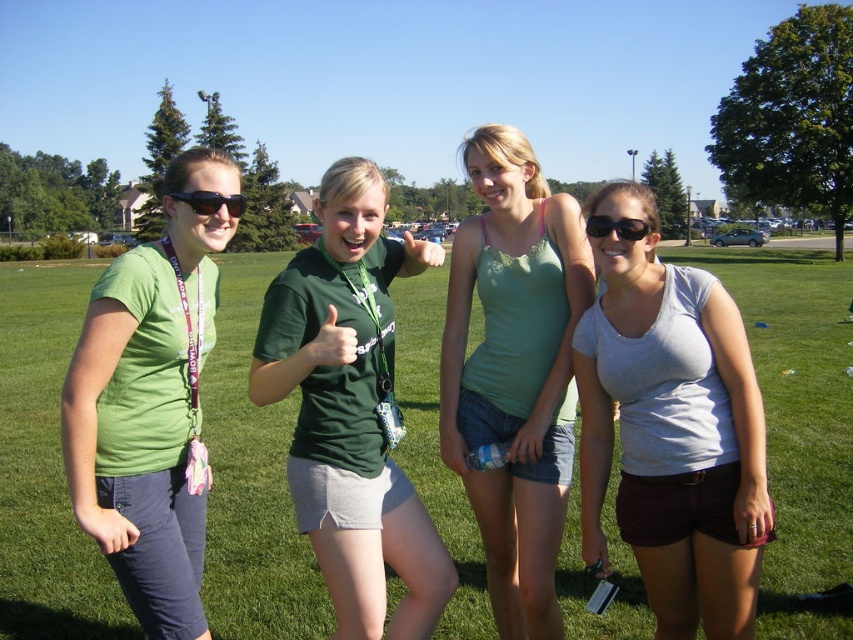
Question: Does green lace tank top at center have a greater width compared to green fabric shirt at left?

Choices:
 (A) yes
 (B) no

Answer: (A)

Question: Considering the relative positions of green grass at center and green fabric shirt at center in the image provided, where is green grass at center located with respect to green fabric shirt at center?

Choices:
 (A) below
 (B) above

Answer: (B)

Question: Can you confirm if green lace tank top at center is wider than black plastic sunglasses at upper center?

Choices:
 (A) no
 (B) yes

Answer: (B)

Question: Which point is farther to the camera?

Choices:
 (A) click(590, 236)
 (B) click(300, 289)
 (C) click(190, 196)

Answer: (A)

Question: Among these points, which one is nearest to the camera?

Choices:
 (A) (193, 211)
 (B) (480, 131)
 (C) (21, 488)

Answer: (A)

Question: Which object appears farthest from the camera in this image?

Choices:
 (A) black plastic sunglasses at upper center
 (B) green lace tank top at center

Answer: (B)